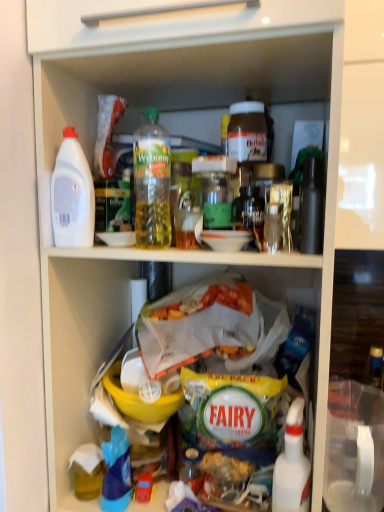
Question: Which direction should I rotate to look at green glass jar at center, positioned as the 3th bottle in left-to-right order, — up or down?

Choices:
 (A) up
 (B) down

Answer: (A)

Question: Does green glass jar at center, positioned as the 3th bottle in left-to-right order, have a larger size compared to blue plastic bottle at lower left?

Choices:
 (A) no
 (B) yes

Answer: (B)

Question: Does green glass jar at center, which is the third bottle in right-to-left order, have a greater height compared to blue plastic bottle at lower left?

Choices:
 (A) no
 (B) yes

Answer: (B)

Question: From the image's perspective, is green glass jar at center, positioned as the 3th bottle in left-to-right order, under blue plastic bottle at lower left?

Choices:
 (A) yes
 (B) no

Answer: (B)

Question: Is blue plastic bottle at lower left inside green glass jar at center, which is the third bottle in right-to-left order?

Choices:
 (A) yes
 (B) no

Answer: (B)

Question: From the image's perspective, is green glass jar at center, positioned as the 3th bottle in left-to-right order, over blue plastic bottle at lower left?

Choices:
 (A) no
 (B) yes

Answer: (B)

Question: Is green glass jar at center, which is the third bottle in right-to-left order, positioned with its back to blue plastic bottle at lower left?

Choices:
 (A) yes
 (B) no

Answer: (B)

Question: Is matte brown jar at upper center, which is the fourth bottle in left-to-right order, at the left side of green glass jar at center, positioned as the 3th bottle in left-to-right order?

Choices:
 (A) yes
 (B) no

Answer: (B)

Question: From the image's perspective, is matte brown jar at upper center, positioned as the 2th bottle in right-to-left order, over green glass jar at center, which is the third bottle in right-to-left order?

Choices:
 (A) yes
 (B) no

Answer: (A)

Question: Can you confirm if matte brown jar at upper center, which is the fourth bottle in left-to-right order, is thinner than green glass jar at center, positioned as the 3th bottle in left-to-right order?

Choices:
 (A) no
 (B) yes

Answer: (B)

Question: From the image's perspective, would you say matte brown jar at upper center, which is the fourth bottle in left-to-right order, is shown under green glass jar at center, which is the third bottle in right-to-left order?

Choices:
 (A) yes
 (B) no

Answer: (B)

Question: From a real-world perspective, is matte brown jar at upper center, which is the fourth bottle in left-to-right order, over green glass jar at center, which is the third bottle in right-to-left order?

Choices:
 (A) no
 (B) yes

Answer: (B)

Question: Is green glass jar at center, positioned as the 3th bottle in left-to-right order, inside matte brown jar at upper center, positioned as the 2th bottle in right-to-left order?

Choices:
 (A) no
 (B) yes

Answer: (A)

Question: Is blue plastic bottle at lower left wider than green glass jar at center, positioned as the 3th bottle in left-to-right order?

Choices:
 (A) yes
 (B) no

Answer: (B)